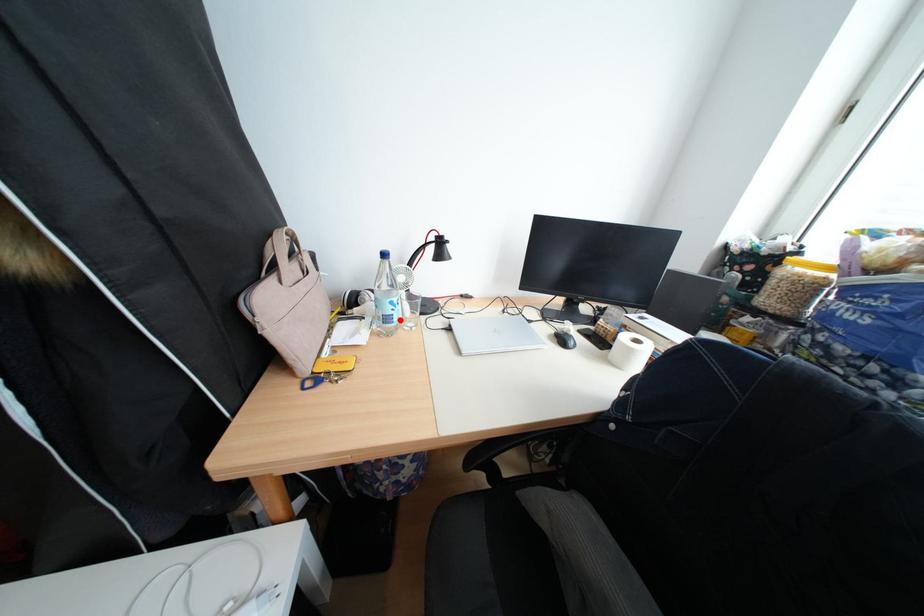
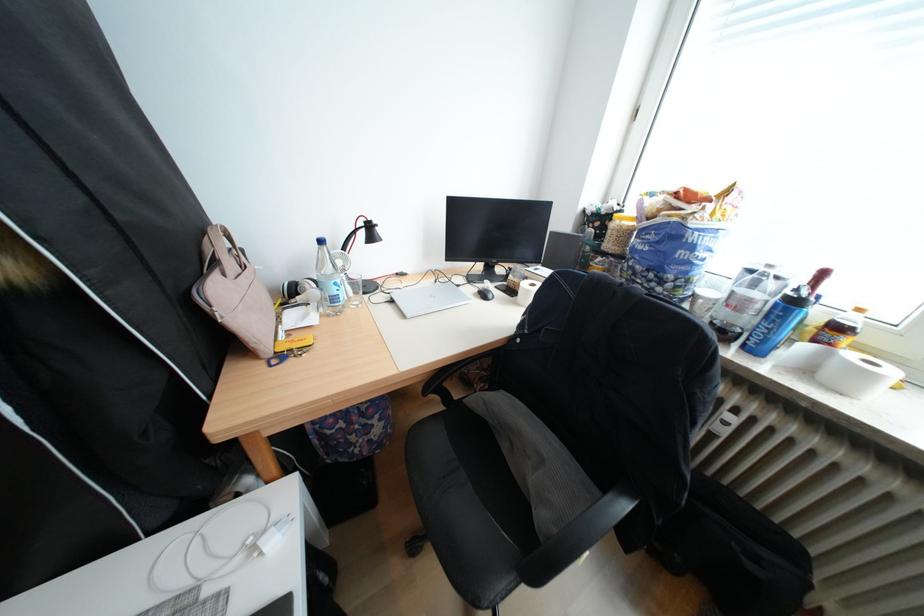
The point at the highlighted location is marked in the first image. Where is the corresponding point in the second image?

(346, 300)